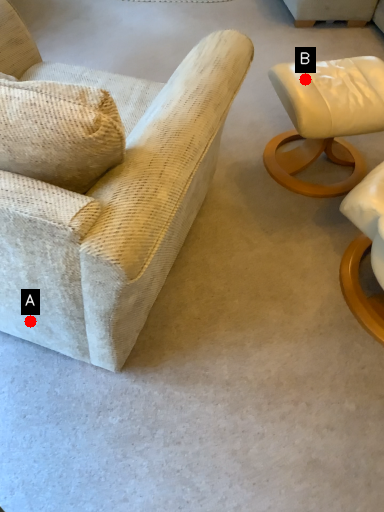
Question: Two points are circled on the image, labeled by A and B beside each circle. Which point appears closest to the camera in this image?

Choices:
 (A) A is closer
 (B) B is closer

Answer: (A)